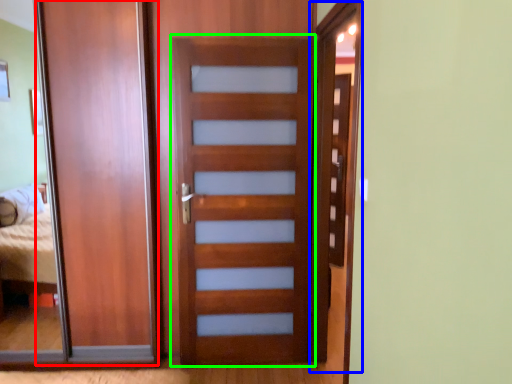
Question: Based on their relative distances, which object is farther from barn door (highlighted by a red box)? Choose from screen door (highlighted by a blue box) and screen door (highlighted by a green box).

Choices:
 (A) screen door
 (B) screen door

Answer: (A)